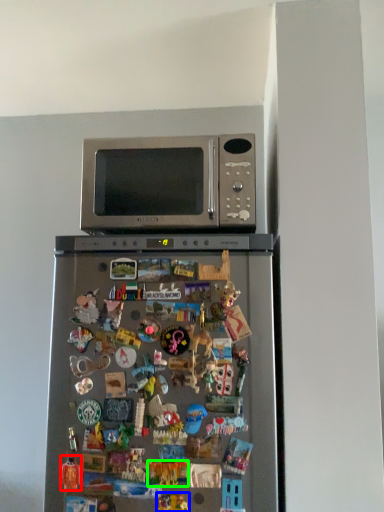
Question: Which object is positioned farthest from toy (highlighted by a red box)? Select from toy (highlighted by a blue box) and toy (highlighted by a green box).

Choices:
 (A) toy
 (B) toy

Answer: (A)